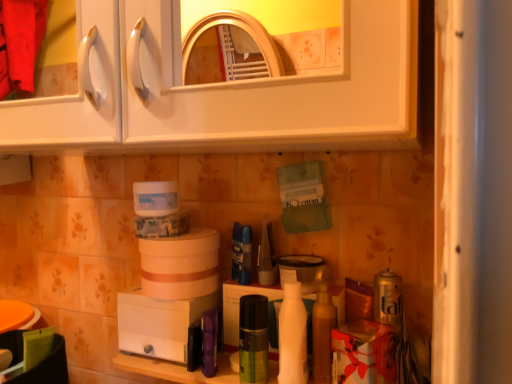
Question: Is white plastic humidifier at lower center, placed as the first appliance when sorted from bottom to top, to the left or to the right of white glossy bottle at center in the image?

Choices:
 (A) left
 (B) right

Answer: (A)

Question: From the image's perspective, is white plastic humidifier at lower center, placed as the first appliance when sorted from bottom to top, positioned above or below white glossy bottle at center?

Choices:
 (A) above
 (B) below

Answer: (B)

Question: Which is farther from the silver metallic can at lower right, which ranks as the 5th toiletry in left-to-right order?

Choices:
 (A) white glossy bottle at center
 (B) white glossy cabinet at upper center
 (C) purple plastic spray can at center, the 1th toiletry when ordered from left to right
 (D) shiny gold lotion at center, the 2th toiletry viewed from the right
 (E) green matte spray can at center, the 4th toiletry in the right-to-left sequence

Answer: (B)

Question: Based on their relative distances, which object is farther from the shiny gold lotion at center, the 2th toiletry viewed from the right?

Choices:
 (A) silver metallic can at lower right, which ranks as the 5th toiletry in left-to-right order
 (B) white glossy cabinet at upper center
 (C) white glossy bottle at center
 (D) matte plastic container at center, positioned as the third toiletry in right-to-left order
 (E) translucent plastic container at center, the 1th appliance viewed from the right

Answer: (B)